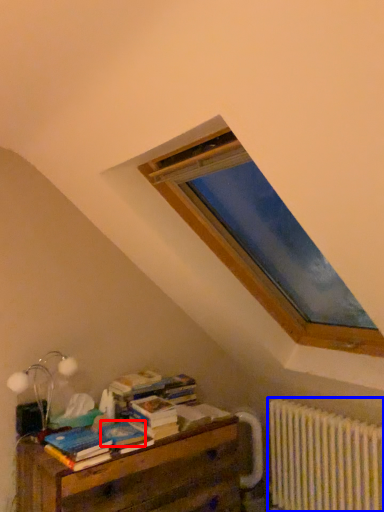
Question: Which object is closer to the camera taking this photo, paperback book (highlighted by a red box) or radiator (highlighted by a blue box)?

Choices:
 (A) paperback book
 (B) radiator

Answer: (A)